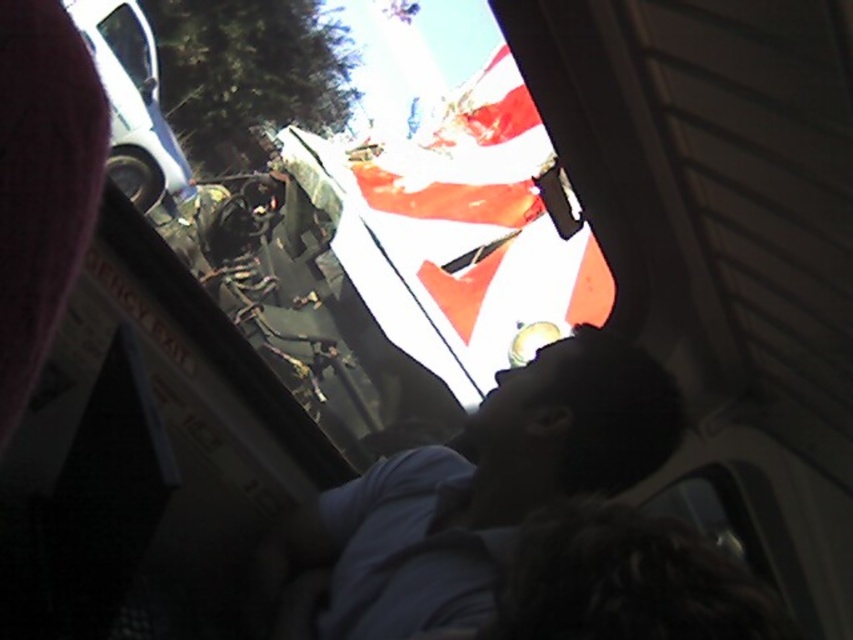
Can you confirm if dark blue shirt at center is taller than transparent glass bus window at upper left?

Incorrect, dark blue shirt at center's height is not larger of transparent glass bus window at upper left's.

Which is behind, point (485, 516) or point (138, 12)?

The point (138, 12) is behind.

Measure the distance between dark blue shirt at center and camera.

The distance of dark blue shirt at center from camera is 1.31 meters.

Locate an element on the screen. dark blue shirt at center is located at coordinates (479, 490).